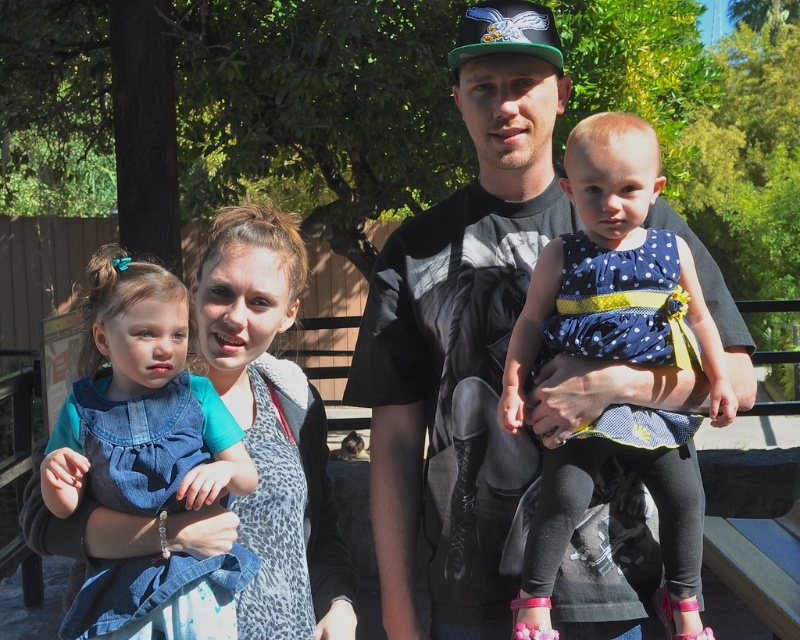
Question: Which object is positioned closest to the polka dot fabric dress at center?

Choices:
 (A) black t-shirt at center
 (B) denim dress at left
 (C) leopard print scarf at center

Answer: (A)

Question: Which is nearer to the polka dot fabric dress at center?

Choices:
 (A) denim dress at left
 (B) leopard print scarf at center
 (C) black t-shirt at center

Answer: (C)

Question: Can you confirm if black t-shirt at center is bigger than denim dress at left?

Choices:
 (A) yes
 (B) no

Answer: (A)

Question: Is polka dot fabric dress at center closer to camera compared to denim dress at left?

Choices:
 (A) yes
 (B) no

Answer: (B)

Question: Which point is farther to the camera?

Choices:
 (A) (140, 333)
 (B) (478, 545)
 (C) (513, 621)
 (D) (312, 390)

Answer: (D)

Question: Is denim dress at left positioned in front of leopard print scarf at center?

Choices:
 (A) yes
 (B) no

Answer: (A)